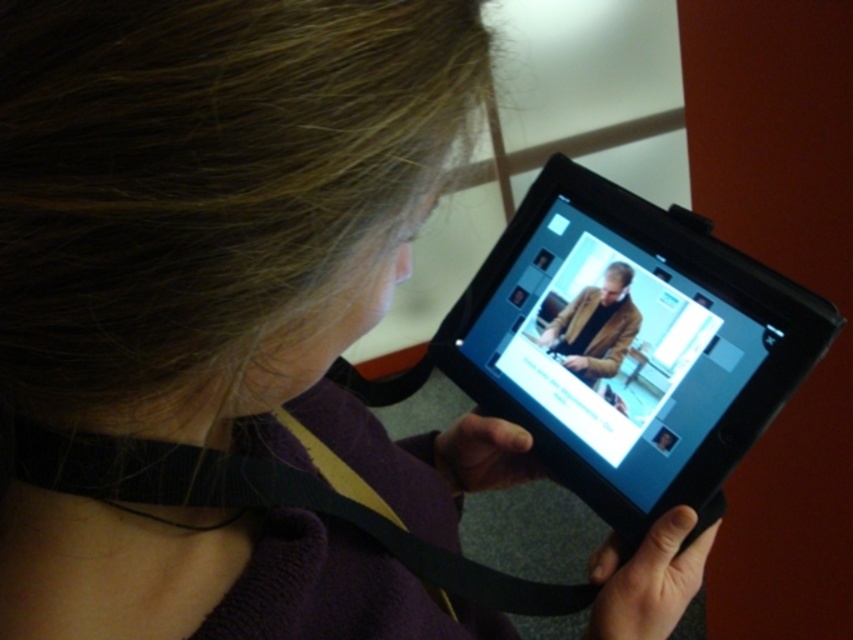
You are standing in front of the image and want to determine which of the two points, point (608,266) or point (569,349), is nearer to you. Based on the scene described, can you identify which point is closer?

Point (608,266) is closer to the viewer than point (569,349).

Based on the photo, you are a delivery robot that needs to deliver a package to the person holding the black plastic tablet at center. The package is 20 inches wide. Can you fit the package between you and the tablet without moving the tablet?

The distance between you and the tablet is 22.30 inches, which is wider than the package width of 20 inches. Yes, you can fit the package between you and the black plastic tablet at center.